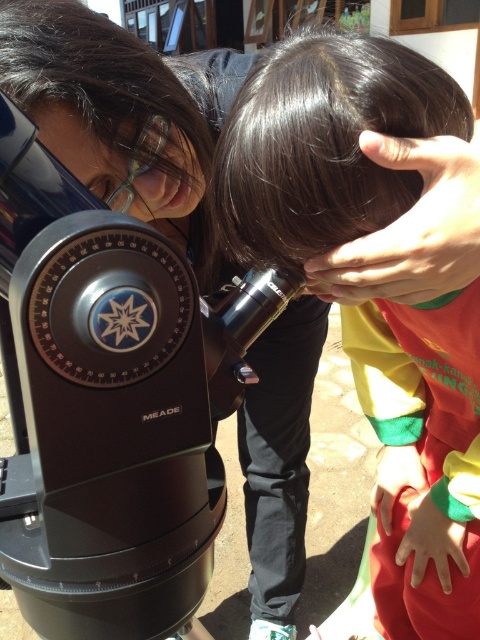
Question: Which of the following is the closest to the observer?

Choices:
 (A) dark brown hair at center
 (B) black plastic telescope at left

Answer: (B)

Question: Which object appears farthest from the camera in this image?

Choices:
 (A) dark brown hair at center
 (B) black plastic telescope at left

Answer: (A)

Question: Where is black plastic telescope at left located in relation to dark brown hair at center in the image?

Choices:
 (A) below
 (B) above

Answer: (B)

Question: Can you confirm if black plastic telescope at left is smaller than dark brown hair at center?

Choices:
 (A) yes
 (B) no

Answer: (A)

Question: Does black plastic telescope at left lie in front of dark brown hair at center?

Choices:
 (A) yes
 (B) no

Answer: (A)